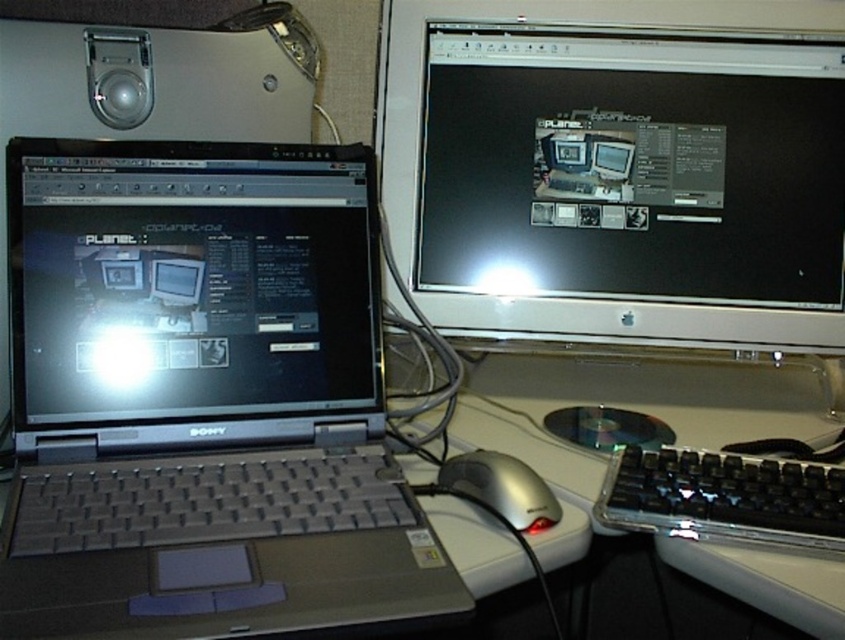
Question: Is satin silver monitor at upper center smaller than clear plastic keyboard at lower right?

Choices:
 (A) no
 (B) yes

Answer: (A)

Question: Among these points, which one is farthest from the camera?

Choices:
 (A) (78, 314)
 (B) (510, 467)
 (C) (789, 508)

Answer: (A)

Question: Can you confirm if silver metallic laptop at left is positioned to the right of silver metallic mouse at center?

Choices:
 (A) yes
 (B) no

Answer: (B)

Question: Which of the following is the closest to the observer?

Choices:
 (A) matte black laptop at left
 (B) silver metallic mouse at center
 (C) clear plastic keyboard at lower right
 (D) white plastic computer desk at center

Answer: (D)

Question: Which of the following is the farthest from the observer?

Choices:
 (A) silver metallic laptop at left
 (B) matte black laptop at left

Answer: (B)

Question: Does silver metallic laptop at left appear on the left side of clear plastic keyboard at lower right?

Choices:
 (A) no
 (B) yes

Answer: (B)